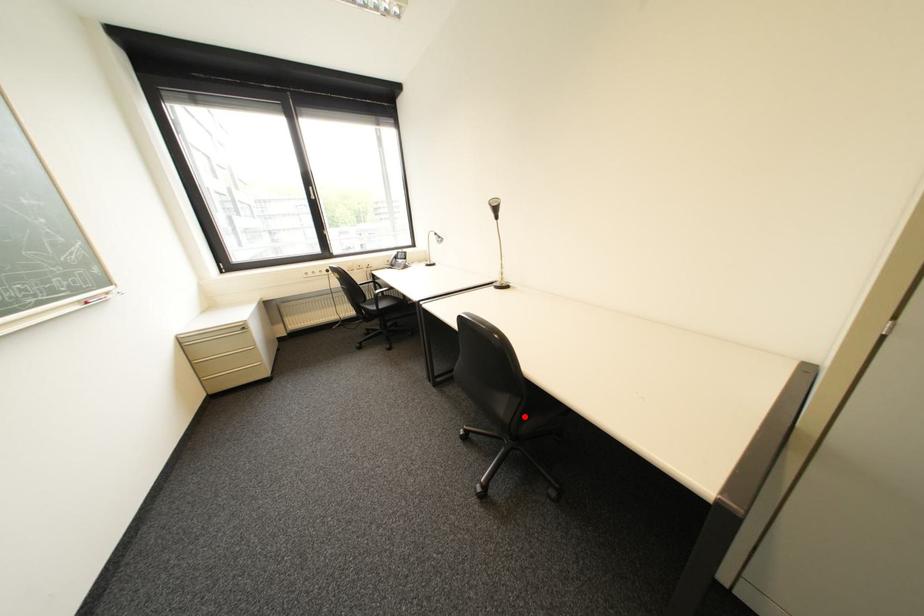
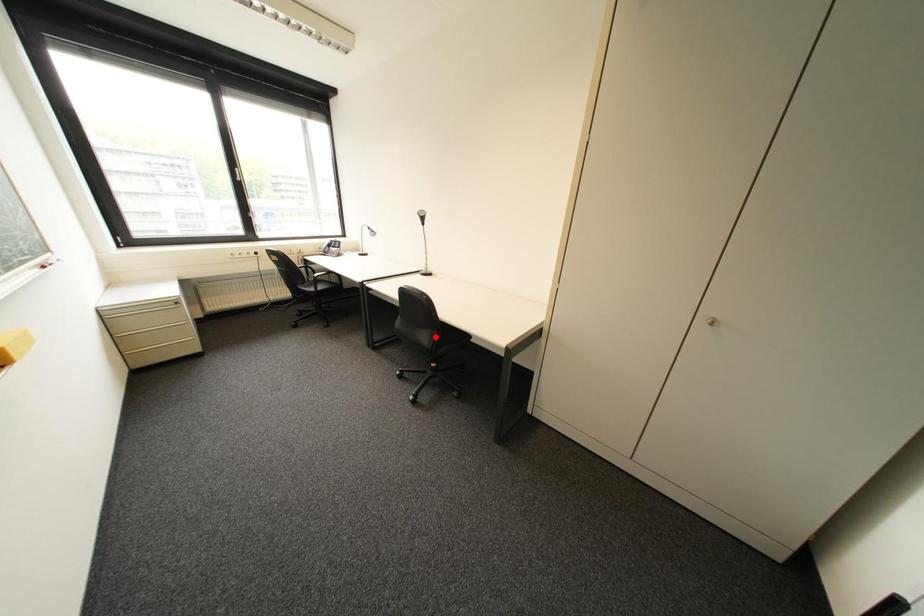
I am providing you with two images of the same scene from different viewpoints. A red point is marked on the first image and another point is marked on the second image. Is the red point in image1 aligned with the point shown in image2?

No